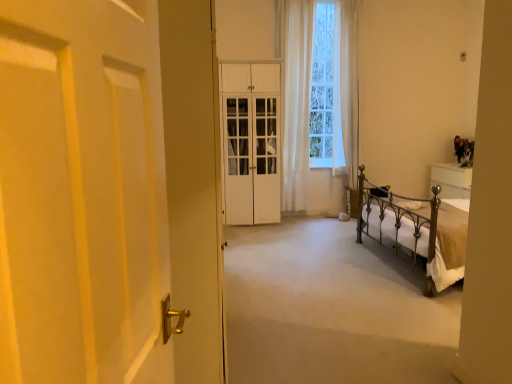
Question: Is point (250, 67) closer or farther from the camera than point (38, 81)?

Choices:
 (A) closer
 (B) farther

Answer: (B)

Question: From a real-world perspective, is white glossy cabinet at center above or below white matte door at left?

Choices:
 (A) below
 (B) above

Answer: (A)

Question: Which is nearer to the white matte door at left?

Choices:
 (A) white glossy cabinet at center
 (B) white sheer curtain at center
 (C) gold metal bed at right
 (D) white carpet at center

Answer: (D)

Question: Based on their relative distances, which object is farther from the white glossy cabinet at center?

Choices:
 (A) white carpet at center
 (B) gold metal bed at right
 (C) white sheer curtain at center
 (D) white matte door at left

Answer: (D)